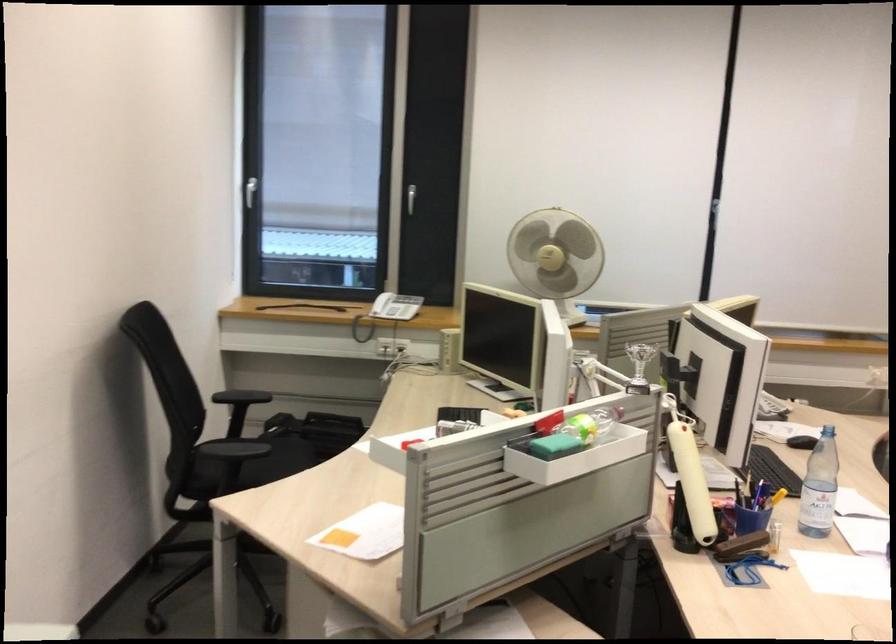
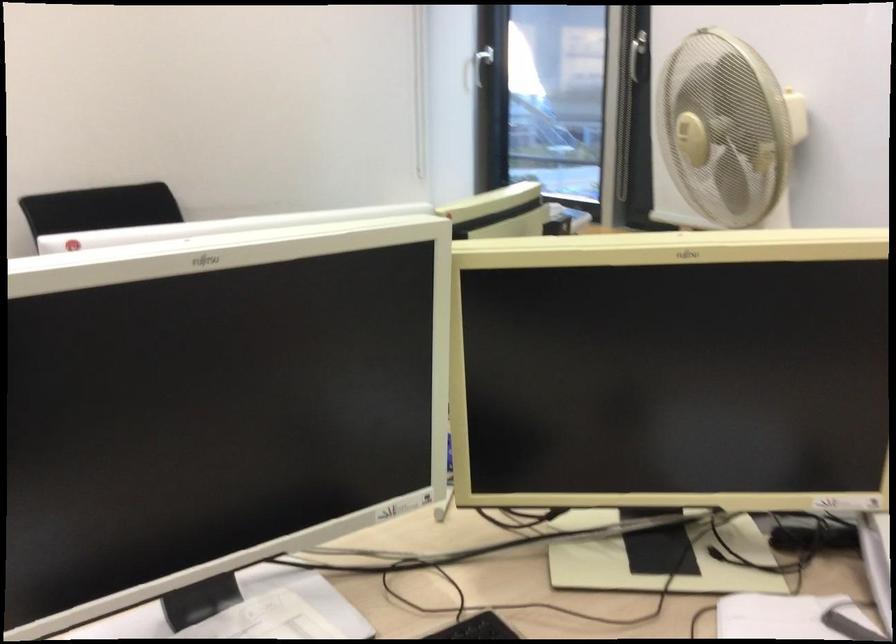
Question: I am providing you with two images of the same scene from different viewpoints. Please identify which objects are invisible in image2.

Choices:
 (A) small red lamp
 (B) chair sitting surface
 (C) fan control knob
 (D) scanner lid

Answer: (B)